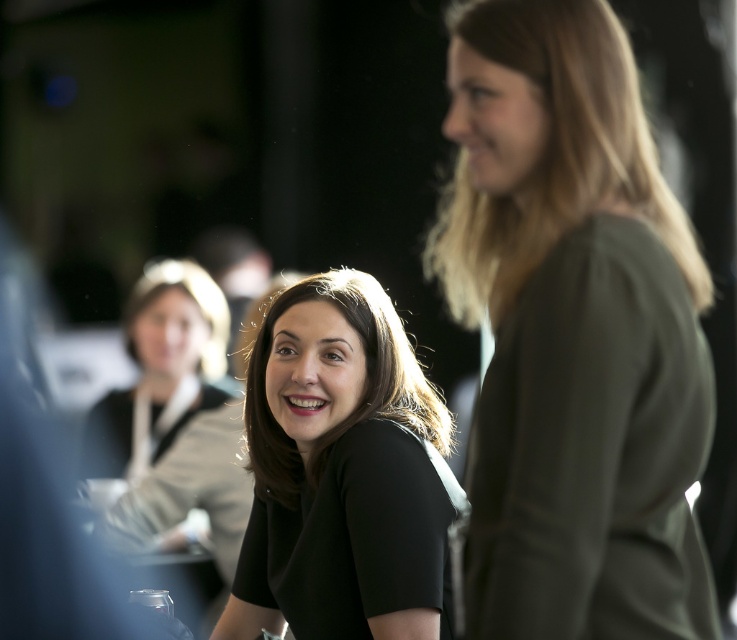
Question: Is olive green jersey at right thinner than black matte shirt at center?

Choices:
 (A) yes
 (B) no

Answer: (A)

Question: Estimate the real-world distances between objects in this image. Which object is farther from the olive green jersey at right?

Choices:
 (A) black matte shirt at center
 (B) matte black shirt at center

Answer: (B)

Question: From the image, what is the correct spatial relationship of black matte shirt at center in relation to matte black shirt at center?

Choices:
 (A) right
 (B) left

Answer: (A)

Question: Which of these objects is positioned closest to the black matte shirt at center?

Choices:
 (A) olive green jersey at right
 (B) matte black shirt at center

Answer: (A)

Question: From the image, what is the correct spatial relationship of black matte shirt at center in relation to matte black shirt at center?

Choices:
 (A) left
 (B) right

Answer: (B)

Question: Estimate the real-world distances between objects in this image. Which object is farther from the olive green jersey at right?

Choices:
 (A) matte black shirt at center
 (B) black matte shirt at center

Answer: (A)